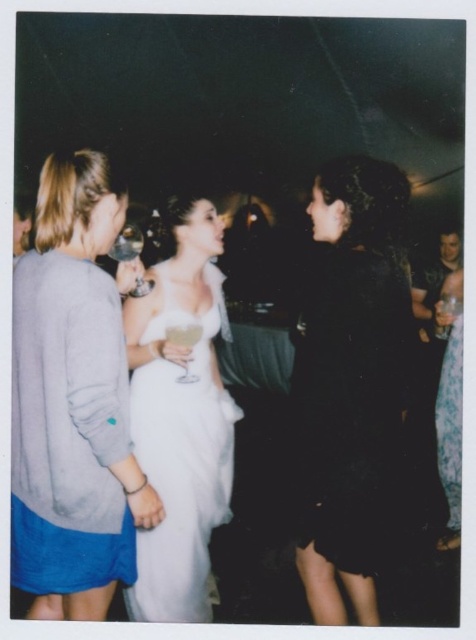
You are at a party and want to choose a wine glass that is easier to grip. Which one would you pick between the clear glass wine glass at center and the transparent plastic wine glass at center?

The transparent plastic wine glass at center is thicker than the clear glass wine glass at center, making it easier to grip.

You are standing at the point marked by the coordinates point (90, 602) in the image. You want to move to the nearest exit, which is located behind the crowd in the background. Considering the crowd density and the lighting, do you think you can navigate through the crowd to reach the exit safely?

The point marked by the coordinates point (90, 602) is 5.27 feet away from the viewer. Since the scene is dimly lit and crowded, navigating through the crowd to reach the exit may be challenging, but possible with caution.